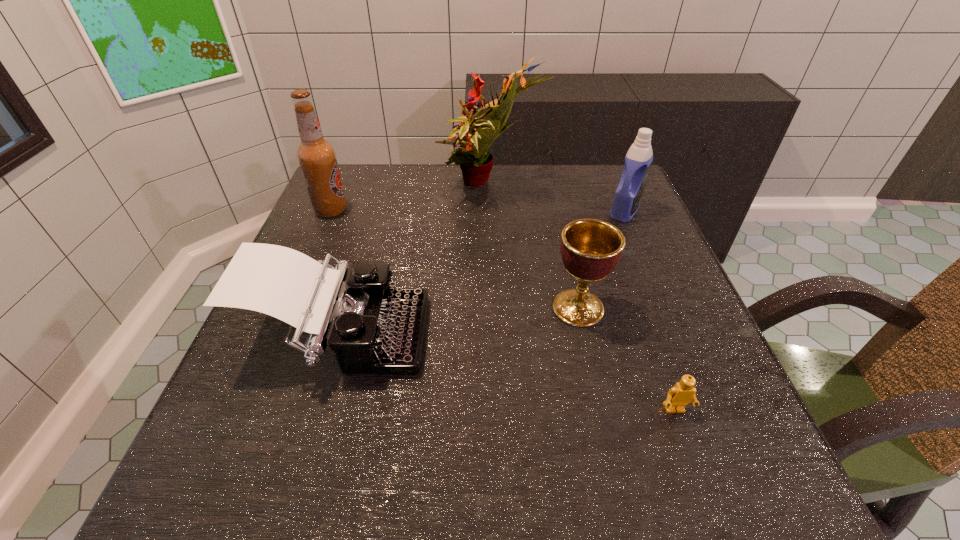
The image size is (960, 540). I want to click on vacant space situated 0.220m on the front label of the beer bottle, so click(x=436, y=211).

What are the coordinates of `vacant space located on the left of the detergent` in the screenshot? It's located at (528, 211).

Locate an element on the screen. This screenshot has width=960, height=540. free space located on the back of the chalice is located at coordinates (564, 248).

Identify the location of free region located on the keys of the typewriter. coord(636,336).

At what (x,y) coordinates should I click in order to perform the action: click on vacant space located on the face of the shortest object. Please return your answer as a coordinate pair (x, y). This screenshot has height=540, width=960. Looking at the image, I should click on (706, 498).

You are a GUI agent. You are given a task and a screenshot of the screen. Output one action in this format:
    pyautogui.click(x=<x>, y=<y>)
    Task: Click on the bouquet that is at the far edge
    The image size is (960, 540).
    Given the screenshot: What is the action you would take?
    pyautogui.click(x=475, y=162)

This screenshot has width=960, height=540. I want to click on beer bottle located at the far edge, so click(317, 157).

Identify the location of detergent at the far edge. The image size is (960, 540). (637, 163).

Where is `beer bottle that is at the left edge`? The height and width of the screenshot is (540, 960). beer bottle that is at the left edge is located at coordinates (317, 157).

Image resolution: width=960 pixels, height=540 pixels. What are the coordinates of `typewriter at the left edge` in the screenshot? It's located at (373, 328).